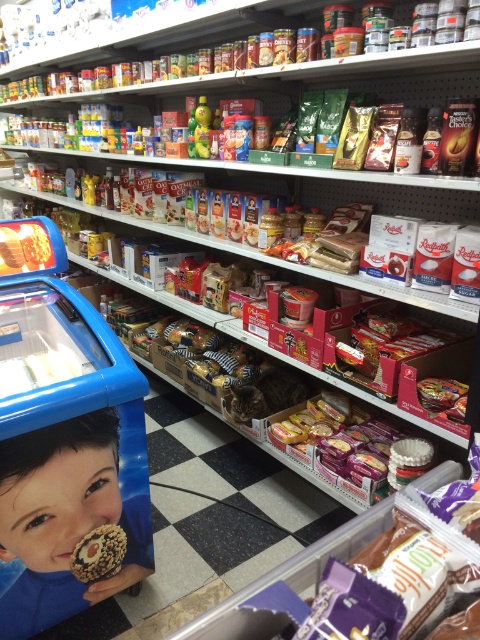
Question: Is the position of smooth skin child at lower left less distant than that of chocolate-coated nuts at lower left?

Choices:
 (A) yes
 (B) no

Answer: (A)

Question: Among these points, which one is farthest from the camera?

Choices:
 (A) (108, 572)
 (B) (52, 493)

Answer: (A)

Question: Can you confirm if smooth skin child at lower left is thinner than chocolate-coated nuts at lower left?

Choices:
 (A) no
 (B) yes

Answer: (A)

Question: Is smooth skin child at lower left above chocolate-coated nuts at lower left?

Choices:
 (A) no
 (B) yes

Answer: (B)

Question: Which of the following is the closest to the observer?

Choices:
 (A) smooth skin child at lower left
 (B) chocolate-coated nuts at lower left

Answer: (A)